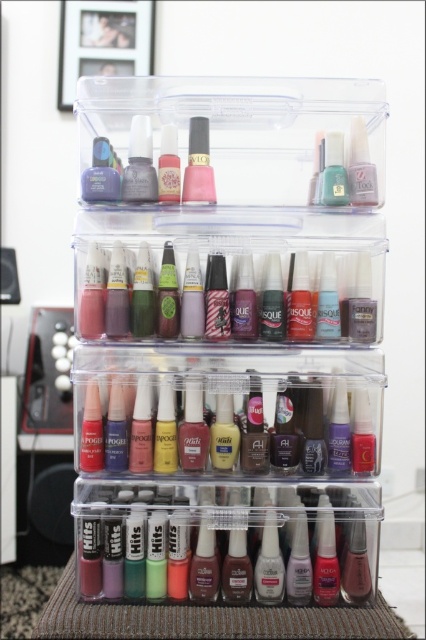
You are a customer trying to reach the shiny metallic lipstick at center from the matte pink nail polish at center. The space between them is narrow. Can you fit your hand through the gap?

The distance between the matte pink nail polish at center and the shiny metallic lipstick at center is 4.95 inches, so yes, your hand can fit through the gap as it is wider than average hand width.

You are a beauty blogger who wants to film a tutorial using both the satin pink nail polish at center and the shiny metallic lipstick at center. You need to place them side by side on your desk. Which one should you place first to ensure they don

The satin pink nail polish at center is much taller than the shiny metallic lipstick at center, so you should place the taller satin pink nail polish at center first to avoid knocking over the shorter shiny metallic lipstick at center.